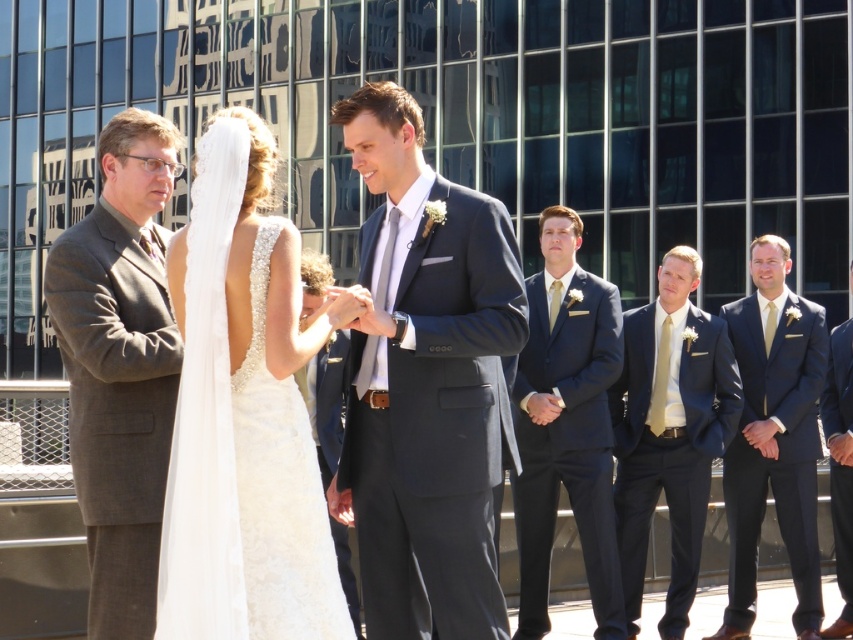
Question: Does matte black suit at center have a greater width compared to gray wool suit at left?

Choices:
 (A) yes
 (B) no

Answer: (A)

Question: Which point appears closest to the camera in this image?

Choices:
 (A) (761, 499)
 (B) (659, 625)
 (C) (392, 141)
 (D) (114, 275)

Answer: (D)

Question: Is matte navy suit at center above dark blue suit at right?

Choices:
 (A) no
 (B) yes

Answer: (B)

Question: Which of the following is the farthest from the observer?

Choices:
 (A) white lace dress at center
 (B) dark blue suit at right
 (C) matte black suit at center
 (D) navy blue suit at center

Answer: (B)

Question: Which object is farther from the camera taking this photo?

Choices:
 (A) navy blue suit at center
 (B) dark blue suit at right
 (C) matte black suit at center

Answer: (B)

Question: Is navy blue suit at center to the right of matte navy suit at center from the viewer's perspective?

Choices:
 (A) yes
 (B) no

Answer: (B)